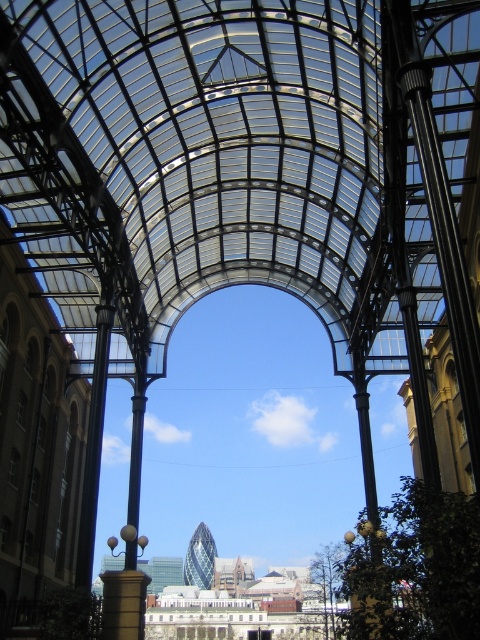
In the scene shown: You are planning to install a new lighting system in the architectural structure. The lighting system requires a cable that can span the distance between the transparent glass roof at center and the metallic pole at center. What is the minimum length of cable required to connect these two points?

The minimum length of cable required to connect the transparent glass roof at center and the metallic pole at center is 48.67 meters, as the distance between them is exactly 48.67 meters.

You are an architect designing a new installation that requires knowing the spatial relationship between the transparent glass roof at center and the metallic pole at center. Which object is wider?

The transparent glass roof at center is wider than the metallic pole at center.

You are standing at the entrance of the architectural structure and want to locate the transparent glass roof at center. According to the coordinates provided, where should you look relative to your position?

The transparent glass roof at center is located at coordinates point (202, 163), so you should look to the upper left direction from your current position.